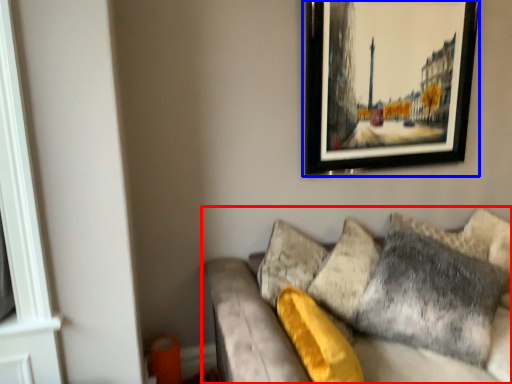
Question: Which object is closer to the camera taking this photo, studio couch (highlighted by a red box) or picture frame (highlighted by a blue box)?

Choices:
 (A) studio couch
 (B) picture frame

Answer: (A)